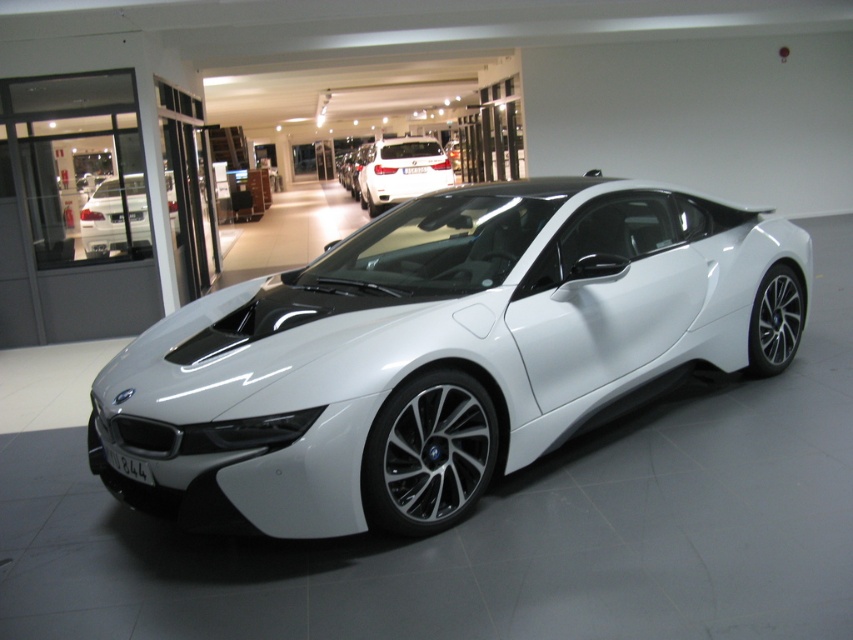
Question: Can you confirm if white glossy sports car at center is bigger than white glossy sedan at center?

Choices:
 (A) yes
 (B) no

Answer: (A)

Question: Which point is closer to the camera?

Choices:
 (A) white matte car at center
 (B) white glossy sedan at center
 (C) white glossy sports car at center

Answer: (C)

Question: Where is white glossy sedan at center located in relation to white matte car at center in the image?

Choices:
 (A) left
 (B) right

Answer: (A)

Question: Which point is closer to the camera taking this photo?

Choices:
 (A) (399, 141)
 (B) (308, 467)

Answer: (B)

Question: Is white glossy sports car at center thinner than white matte car at center?

Choices:
 (A) yes
 (B) no

Answer: (B)

Question: Which point appears closest to the camera in this image?

Choices:
 (A) (430, 186)
 (B) (393, 300)

Answer: (B)